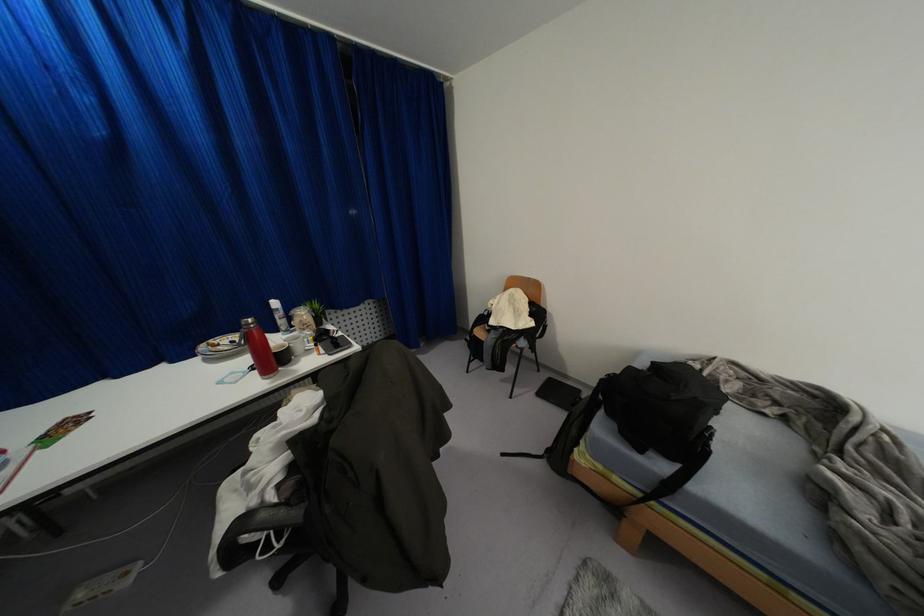
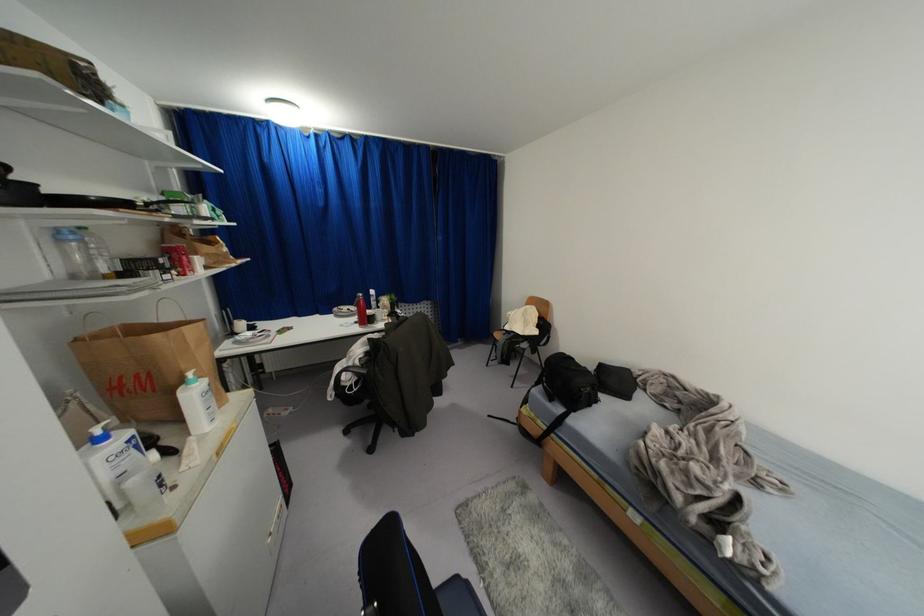
Question: How did the camera likely rotate?

Choices:
 (A) Left
 (B) Right
 (C) Up
 (D) Down

Answer: (A)